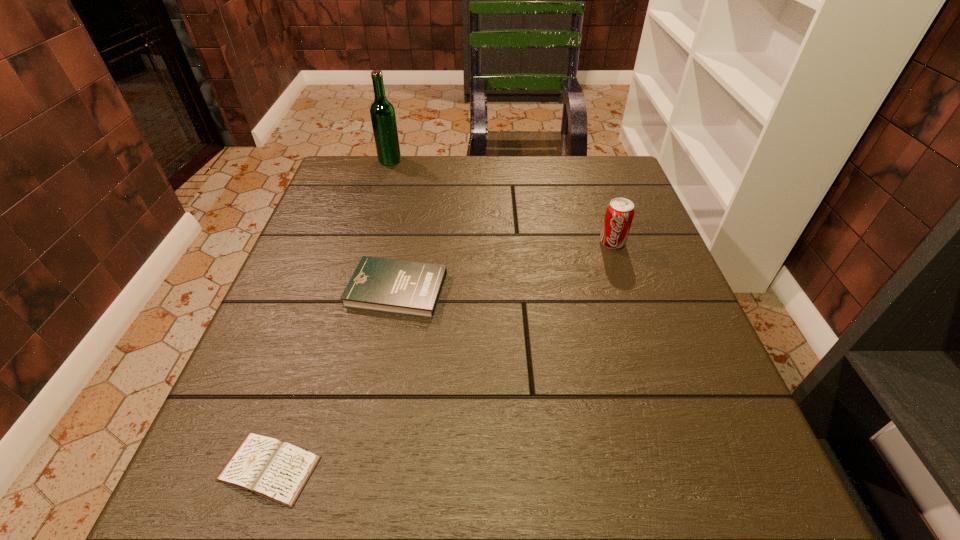
Image resolution: width=960 pixels, height=540 pixels. Identify the location of vacant space located on the back of the third farthest object. (418, 183).

Find the location of a particular element. This screenshot has width=960, height=540. free space located on the back of the nearest object is located at coordinates (322, 314).

You are a GUI agent. You are given a task and a screenshot of the screen. Output one action in this format:
    pyautogui.click(x=<x>, y=<y>)
    Task: Click on the object at the far edge
    The image size is (960, 540).
    Given the screenshot: What is the action you would take?
    pyautogui.click(x=382, y=113)

What are the coordinates of `object that is at the near edge` in the screenshot? It's located at (265, 466).

The width and height of the screenshot is (960, 540). Find the location of `beer bottle at the left edge`. beer bottle at the left edge is located at coordinates (382, 113).

Where is `book located at the left edge`? The height and width of the screenshot is (540, 960). book located at the left edge is located at coordinates (403, 287).

This screenshot has height=540, width=960. I want to click on diary that is positioned at the left edge, so click(265, 466).

Where is `object positioned at the right edge`? Image resolution: width=960 pixels, height=540 pixels. object positioned at the right edge is located at coordinates (619, 214).

Where is `object that is at the far left corner`? Image resolution: width=960 pixels, height=540 pixels. object that is at the far left corner is located at coordinates (382, 113).

At what (x,y) coordinates should I click in order to perform the action: click on object located at the near left corner. Please return your answer as a coordinate pair (x, y). The image size is (960, 540). Looking at the image, I should click on (265, 466).